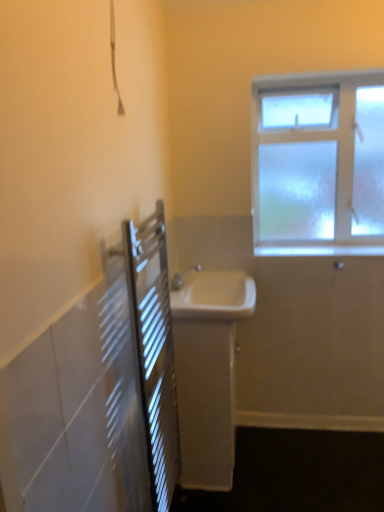
Where is `unoccupied region to the right of white glossy sink at center, which is the second sink in top-to-bottom order`? The height and width of the screenshot is (512, 384). unoccupied region to the right of white glossy sink at center, which is the second sink in top-to-bottom order is located at coordinates (271, 453).